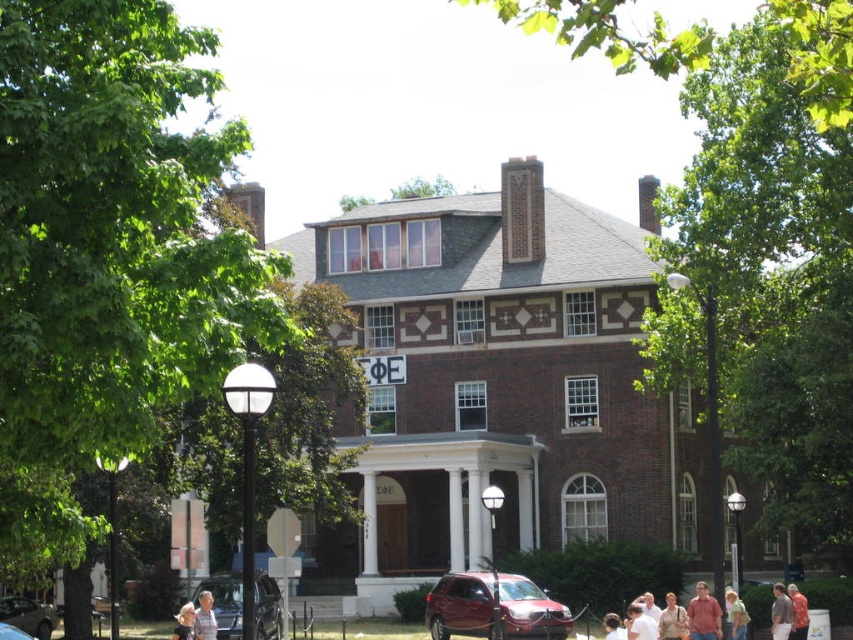
Question: Among these objects, which one is nearest to the camera?

Choices:
 (A) shiny red suv at lower center
 (B) light blue shirt at center
 (C) light brown shirt at center
 (D) blonde hair at center

Answer: (D)

Question: Can you confirm if shiny red suv at lower center is positioned above blonde hair at center?

Choices:
 (A) yes
 (B) no

Answer: (A)

Question: Among these objects, which one is nearest to the camera?

Choices:
 (A) gray fabric shirt at lower left
 (B) shiny red suv at lower center
 (C) shiny black sedan at lower left

Answer: (C)

Question: Does matte orange shirt at lower right have a lesser width compared to light brown leather jacket at center?

Choices:
 (A) no
 (B) yes

Answer: (A)

Question: Observing the image, what is the correct spatial positioning of light brown shirt at center in reference to blonde hair at center?

Choices:
 (A) right
 (B) left

Answer: (A)

Question: Which object is the farthest from the blonde hair at lower left?

Choices:
 (A) shiny black sedan at lower left
 (B) light blue shirt at center

Answer: (B)